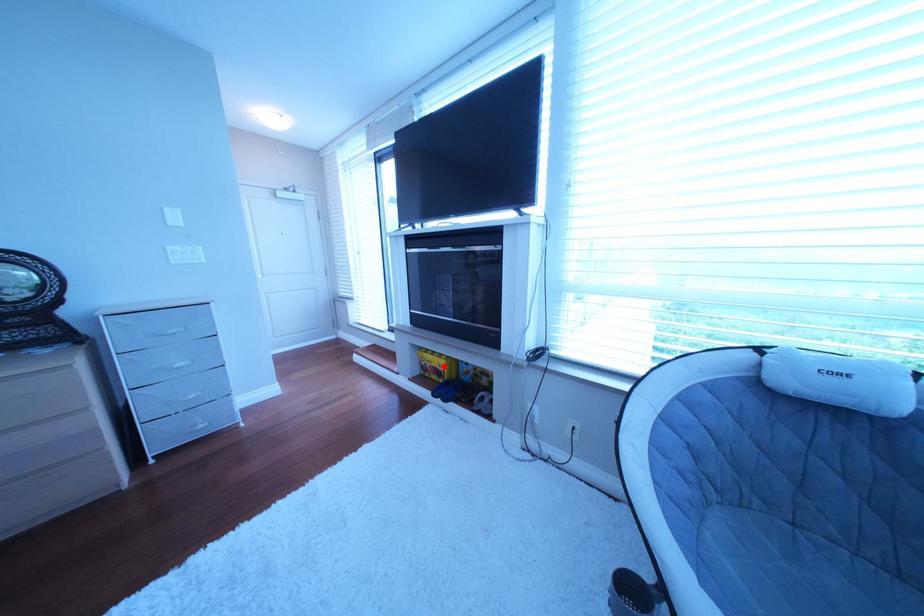
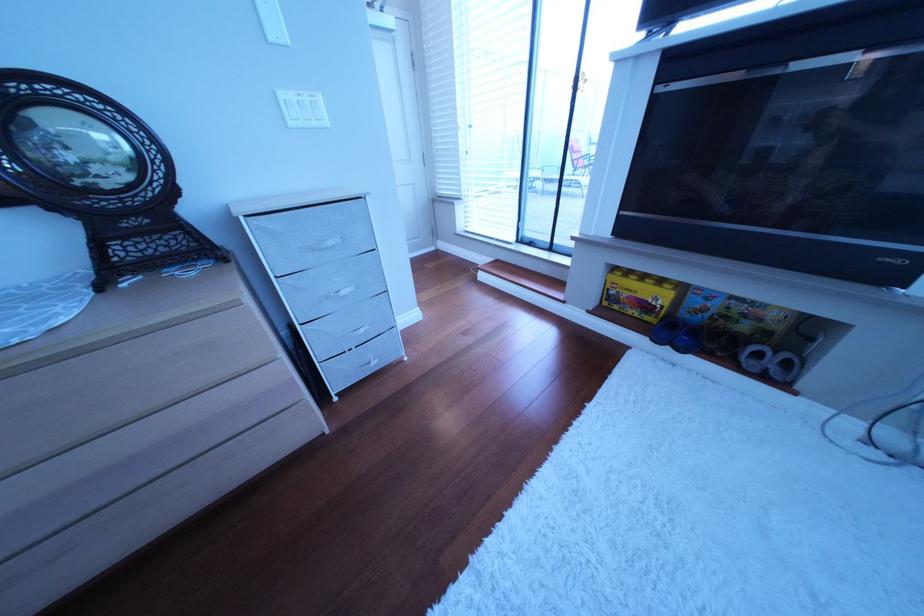
Locate, in the second image, the point that corresponds to the highlighted location in the first image.

(640, 296)